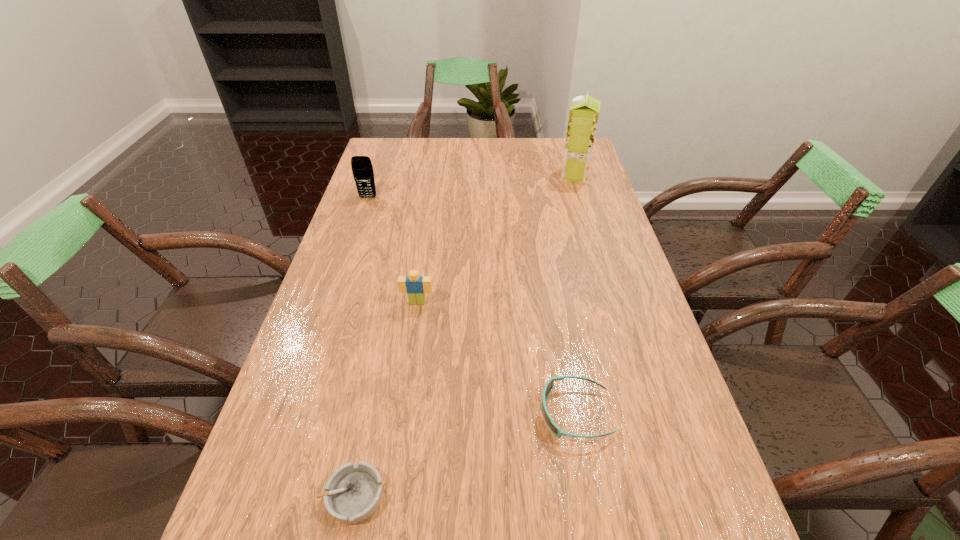
This screenshot has height=540, width=960. In order to click on the tallest object in this screenshot , I will do `click(584, 111)`.

At what (x,y) coordinates should I click in order to perform the action: click on soya milk. Please return your answer as a coordinate pair (x, y). Looking at the image, I should click on (584, 111).

Locate an element on the screen. This screenshot has width=960, height=540. the fourth nearest object is located at coordinates (362, 169).

Locate an element on the screen. The image size is (960, 540). the leftmost object is located at coordinates (362, 169).

Where is `the third nearest object`? This screenshot has height=540, width=960. the third nearest object is located at coordinates (415, 286).

Find the location of a particular element. Image resolution: width=960 pixels, height=540 pixels. Lego is located at coordinates (415, 286).

Identify the location of the second object from right to left. (549, 386).

Locate an element on the screen. The image size is (960, 540). sunglasses is located at coordinates (549, 386).

Where is `ashtray`? This screenshot has width=960, height=540. ashtray is located at coordinates (354, 492).

Locate an element on the screen. Image resolution: width=960 pixels, height=540 pixels. the shortest object is located at coordinates (354, 492).